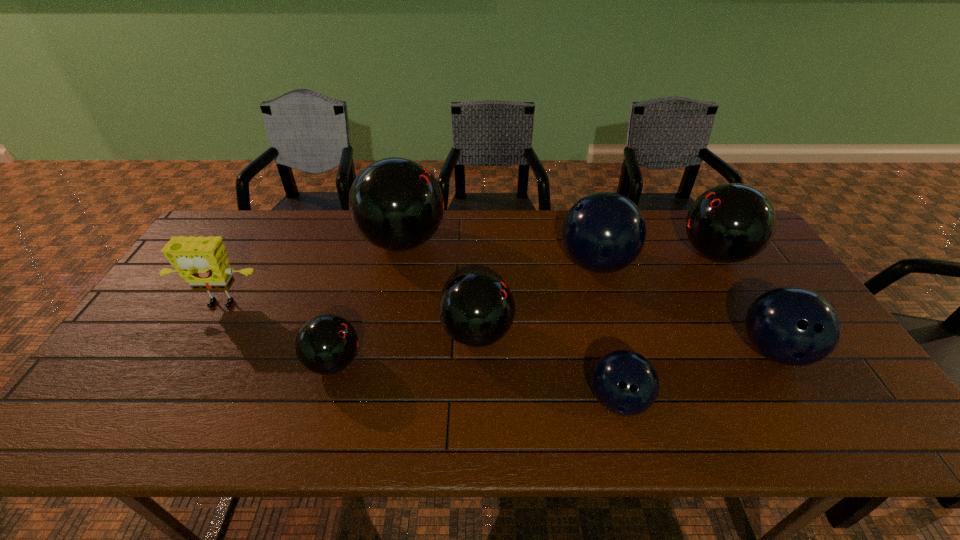
Identify the location of the tallest object. This screenshot has height=540, width=960. (396, 204).

This screenshot has width=960, height=540. Identify the location of the biggest black bowling ball. (396, 204).

Identify the location of the farthest blue bowling ball. This screenshot has width=960, height=540. (604, 232).

Where is `the rightmost black bowling ball`? This screenshot has width=960, height=540. the rightmost black bowling ball is located at coordinates (729, 223).

Image resolution: width=960 pixels, height=540 pixels. What are the coordinates of `the leftmost object` in the screenshot? It's located at pos(201,261).

Find the location of a particular element. yellow sponge is located at coordinates (201, 261).

Locate an element on the screen. The width and height of the screenshot is (960, 540). the third bowling ball from left to right is located at coordinates (476, 309).

Identify the location of the fifth object from right to left. Image resolution: width=960 pixels, height=540 pixels. (476, 309).

The height and width of the screenshot is (540, 960). Identify the location of the second smallest blue bowling ball. (794, 326).

This screenshot has width=960, height=540. I want to click on the smallest black bowling ball, so click(x=326, y=344).